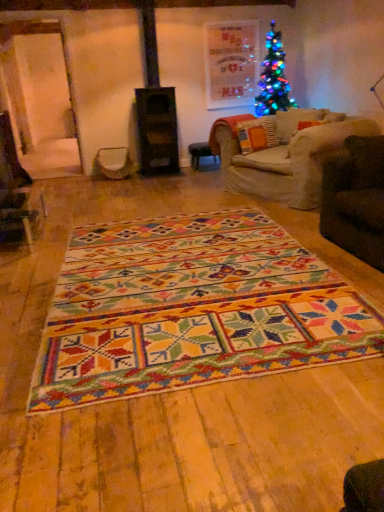
Question: Is wooden stool at center in contact with multicolored woven rug at center?

Choices:
 (A) no
 (B) yes

Answer: (A)

Question: Does wooden stool at center have a lesser height compared to multicolored woven rug at center?

Choices:
 (A) yes
 (B) no

Answer: (B)

Question: From the image's perspective, is wooden stool at center over multicolored woven rug at center?

Choices:
 (A) no
 (B) yes

Answer: (B)

Question: Can multicolored woven rug at center be found inside wooden stool at center?

Choices:
 (A) no
 (B) yes

Answer: (A)

Question: Does wooden stool at center have a lesser width compared to multicolored woven rug at center?

Choices:
 (A) no
 (B) yes

Answer: (B)

Question: Considering the relative positions of multicolored woven rug at center and textured orange pillow at center in the image provided, is multicolored woven rug at center to the left or to the right of textured orange pillow at center?

Choices:
 (A) left
 (B) right

Answer: (A)

Question: Relative to textured orange pillow at center, is multicolored woven rug at center in front or behind?

Choices:
 (A) behind
 (B) front

Answer: (B)

Question: From the image's perspective, is multicolored woven rug at center located above or below textured orange pillow at center?

Choices:
 (A) above
 (B) below

Answer: (B)

Question: Which is correct: multicolored woven rug at center is inside textured orange pillow at center, or outside of it?

Choices:
 (A) inside
 (B) outside

Answer: (B)

Question: Considering their positions, is wooden stool at center located in front of or behind metallic silver swivel chair at center?

Choices:
 (A) behind
 (B) front

Answer: (A)

Question: Based on their sizes in the image, would you say wooden stool at center is bigger or smaller than metallic silver swivel chair at center?

Choices:
 (A) small
 (B) big

Answer: (A)

Question: From the image's perspective, is wooden stool at center positioned above or below metallic silver swivel chair at center?

Choices:
 (A) above
 (B) below

Answer: (A)

Question: Is wooden stool at center spatially inside metallic silver swivel chair at center, or outside of it?

Choices:
 (A) outside
 (B) inside

Answer: (A)

Question: Considering the relative positions of metallic silver swivel chair at center and multicolored woven rug at center in the image provided, is metallic silver swivel chair at center to the left or to the right of multicolored woven rug at center?

Choices:
 (A) left
 (B) right

Answer: (A)

Question: In the image, is metallic silver swivel chair at center positioned in front of or behind multicolored woven rug at center?

Choices:
 (A) behind
 (B) front

Answer: (A)